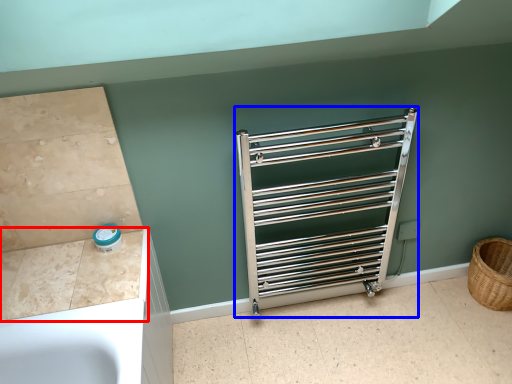
Question: Among these objects, which one is nearest to the camera, counter top (highlighted by a red box) or cage (highlighted by a blue box)?

Choices:
 (A) counter top
 (B) cage

Answer: (A)